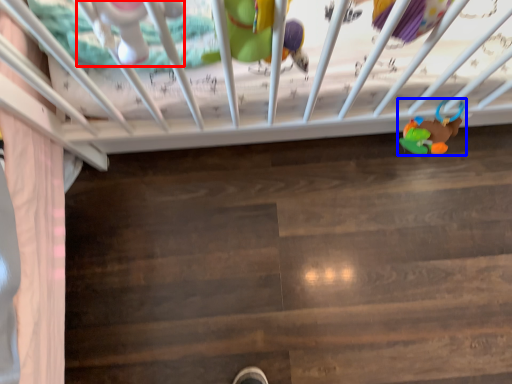
Question: Which object is closer to the camera taking this photo, toy (highlighted by a red box) or toy (highlighted by a blue box)?

Choices:
 (A) toy
 (B) toy

Answer: (A)